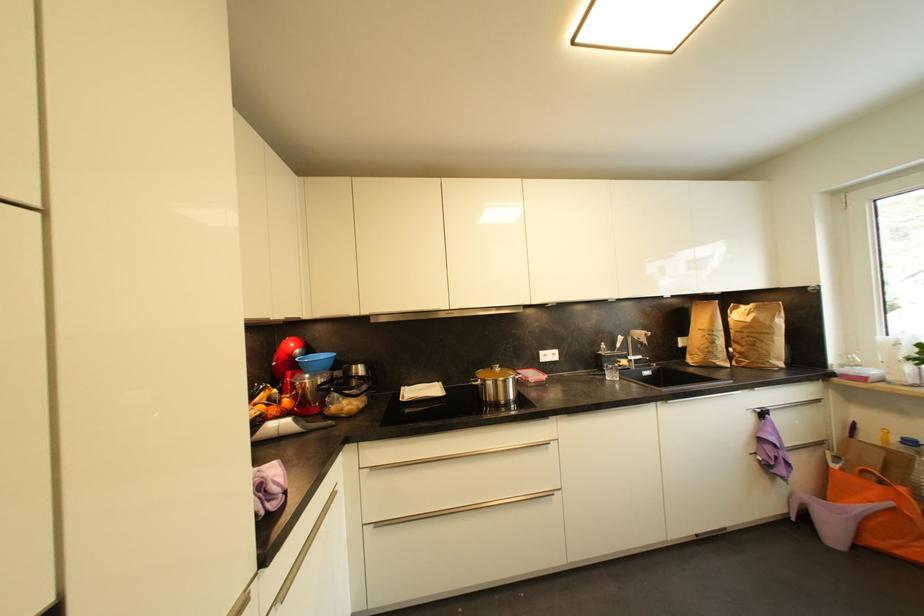
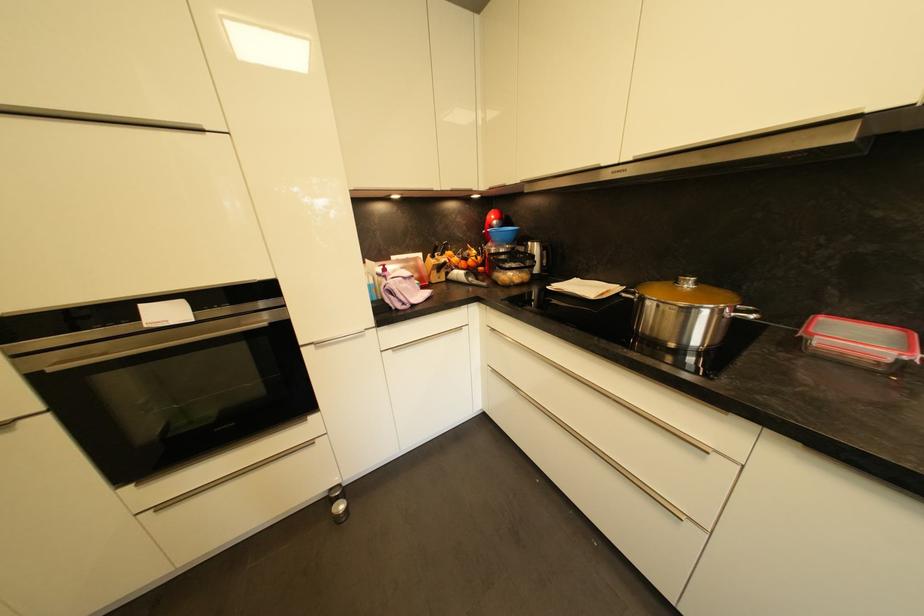
The images are taken continuously from a first-person perspective. In which direction is your viewpoint rotating?

The camera's rotation is toward left-down.